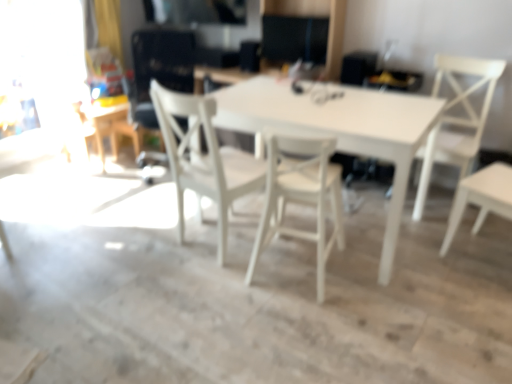
The width and height of the screenshot is (512, 384). I want to click on free space in front of white wood chair at center, positioned as the second chair in right-to-left order, so click(305, 319).